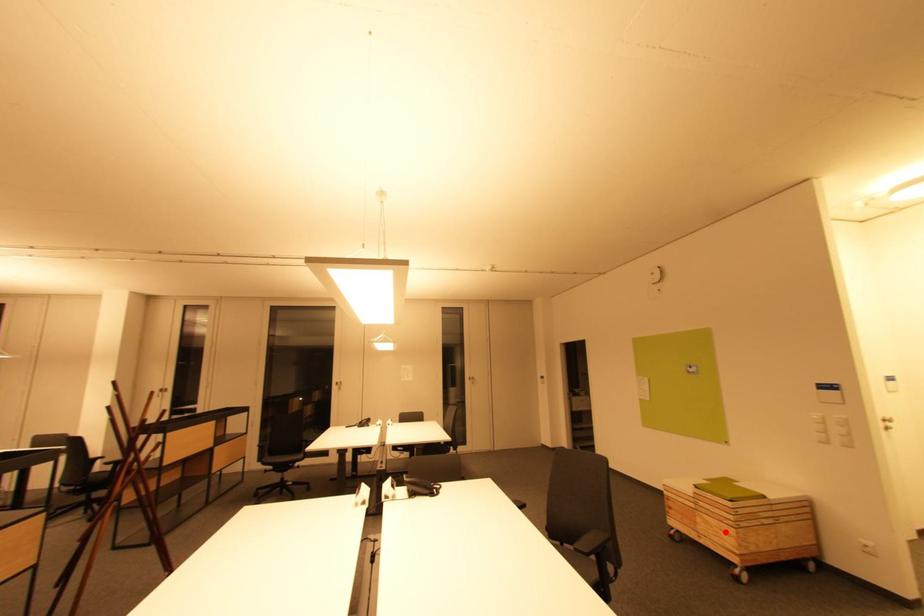
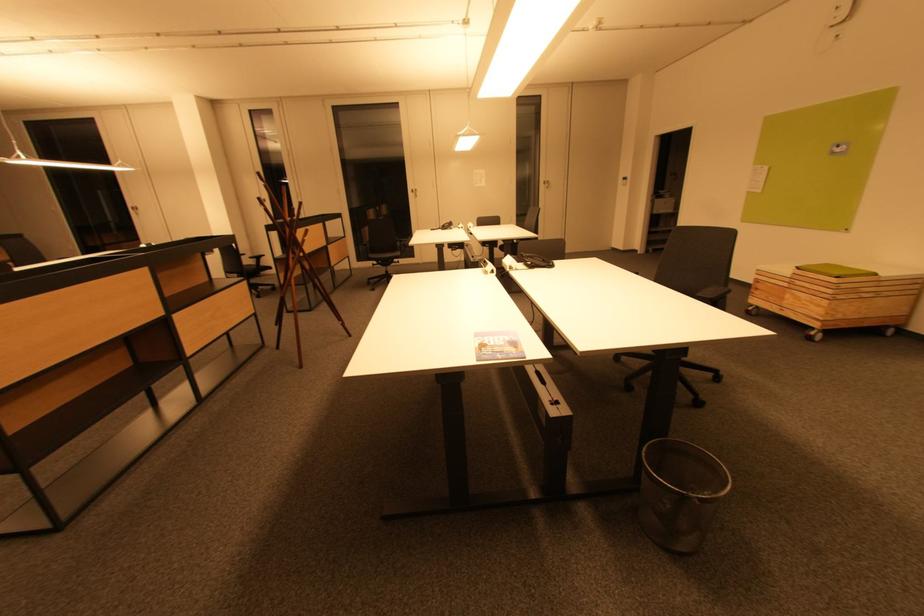
Question: I am providing you with two images of the same scene from different viewpoints. Given a red point in image1, look at the same physical point in image2. Is it:

Choices:
 (A) Closer to the viewpoint
 (B) Farther from the viewpoint

Answer: (B)